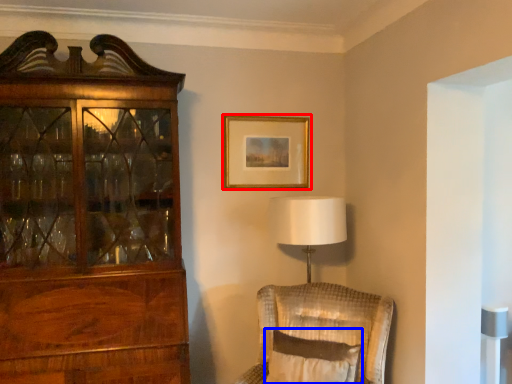
Question: Which object is closer to the camera taking this photo, picture frame (highlighted by a red box) or pillow (highlighted by a blue box)?

Choices:
 (A) picture frame
 (B) pillow

Answer: (B)